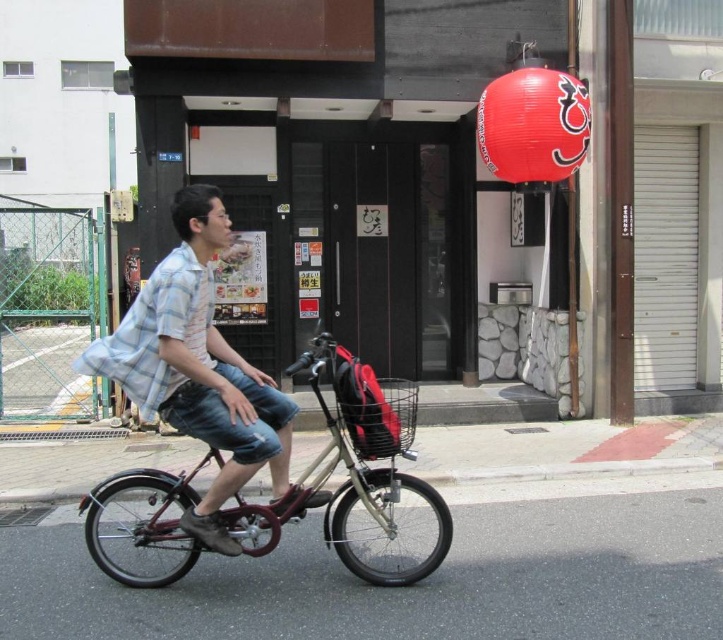
Question: Does light blue plaid shirt at center appear over shiny red paper lantern at upper center?

Choices:
 (A) yes
 (B) no

Answer: (B)

Question: Which of the following is the farthest from the observer?

Choices:
 (A) light blue plaid shirt at center
 (B) shiny red paper lantern at upper center

Answer: (B)

Question: Does light blue plaid shirt at center come behind shiny red paper lantern at upper center?

Choices:
 (A) no
 (B) yes

Answer: (A)

Question: Estimate the real-world distances between objects in this image. Which object is farther from the metallic maroon bicycle at center?

Choices:
 (A) shiny red paper lantern at upper center
 (B) light blue plaid shirt at center

Answer: (A)

Question: Is light blue plaid shirt at center wider than shiny red paper lantern at upper center?

Choices:
 (A) no
 (B) yes

Answer: (B)

Question: Among these objects, which one is nearest to the camera?

Choices:
 (A) metallic maroon bicycle at center
 (B) light blue plaid shirt at center

Answer: (B)